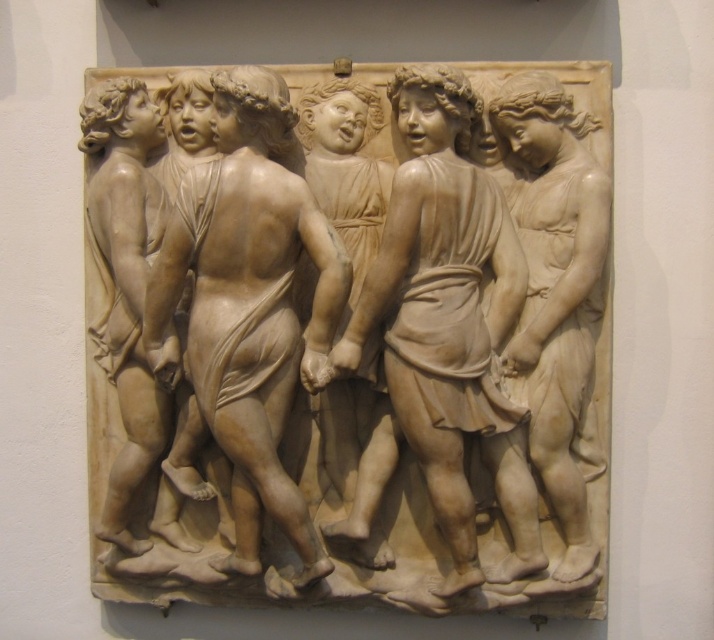
You are an art conservator examining the relief sculpture. You notice two points on the sculpture at coordinates point (156, 262) and point (378, 163). Which point is positioned closer to the viewer?

Point (156, 262) is closer to the camera than point (378, 163).

You are an art conservator examining a classical relief sculpture. You notice a specific point at coordinates point (346, 337). Based on the scene description, where is this point located?

The point (346, 337) is on the white marble relief at center.

You are an art conservator examining the classical relief sculpture. You notice two cherubs, the white marble cherub at right and the smooth beige cherub at left. Which cherub is shorter in height?

The white marble cherub at right has a lesser height compared to the smooth beige cherub at left, so the white marble cherub at right is shorter.